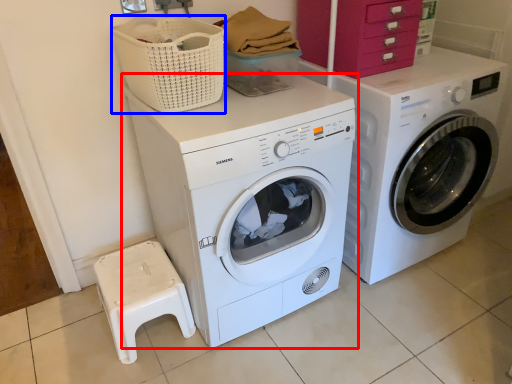
Question: Which object appears farthest to the camera in this image, washing machine (highlighted by a red box) or basket (highlighted by a blue box)?

Choices:
 (A) washing machine
 (B) basket

Answer: (B)